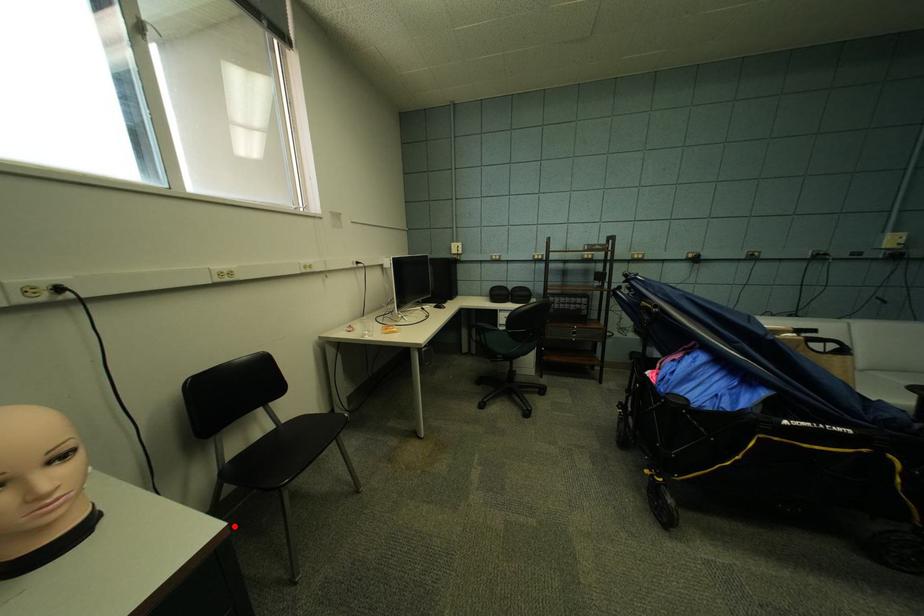
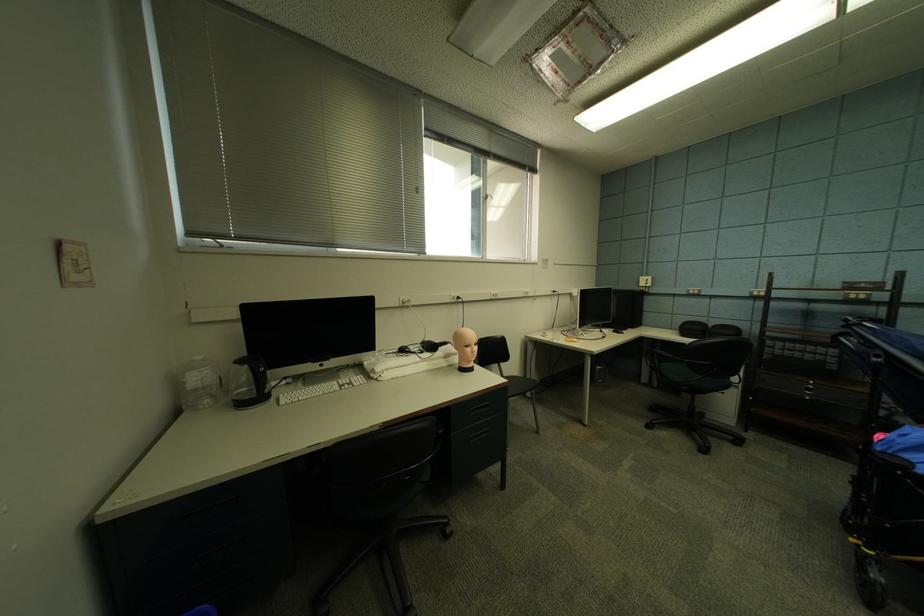
Question: I am providing you with two images of the same scene from different viewpoints. Image1 has a red point marked. In image2, the corresponding 3D location appears at what relative position? Reply with the corresponding letter.

Choices:
 (A) Closer
 (B) Farther

Answer: (A)